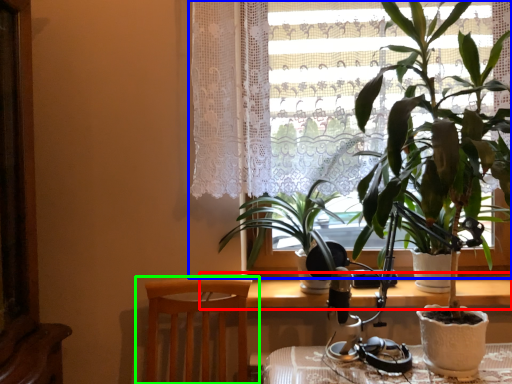
Question: Based on their relative distances, which object is nearer to table (highlighted by a red box)? Choose from window (highlighted by a blue box) and chair (highlighted by a green box).

Choices:
 (A) window
 (B) chair

Answer: (B)